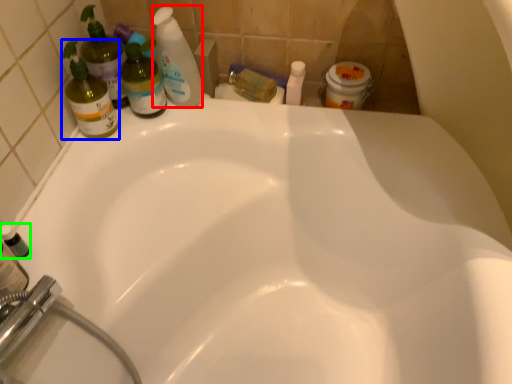
Question: Which object is positioned closest to cleaning product (highlighted by a red box)? Select from cleaning product (highlighted by a blue box) and mouthwash (highlighted by a green box).

Choices:
 (A) cleaning product
 (B) mouthwash

Answer: (A)